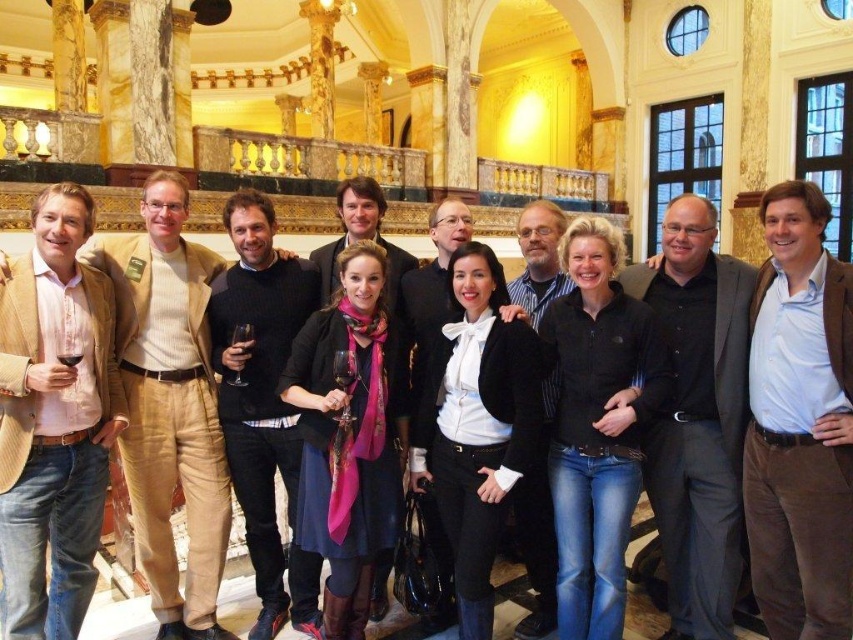
You are a photographer standing at the entrance of the grand building. You want to take a photo of the black matte blazer at center. Where should you position yourself to capture it in the frame?

The black matte blazer at center is located at point (474, 422), so you should position yourself facing the center of the grand building to capture it in the frame.

You are standing in the grand building and want to take a photo of two specific points marked in the scene. The first point is at coordinates point [577,387] and the second is at point [460,548]. Which point should you focus on first if you want to capture both in a single shot without moving the camera?

You should focus on point [577,387] first because it is closer to the camera than point [460,548], ensuring both points remain in focus when adjusting the camera settings.

You are standing at the entrance of the building and want to find the black fleece jacket at center. Based on the coordinates provided in the scene description, in which direction should you move to locate it?

The black fleece jacket at center is located at coordinates point [596,426]. Since you are at the entrance, moving towards the center of the room would place you closer to the jacket.